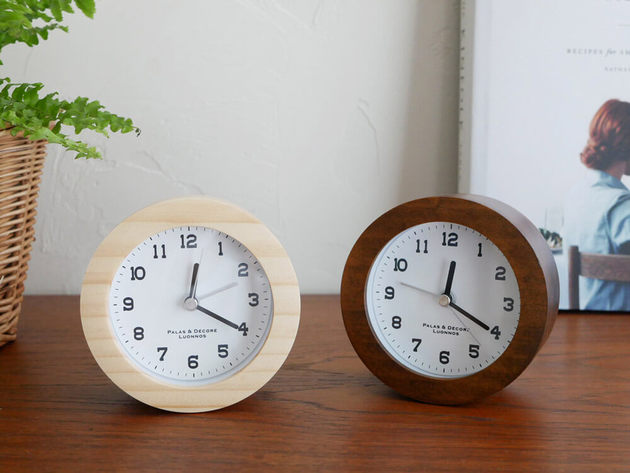
Identify the location of basket. (23, 179).